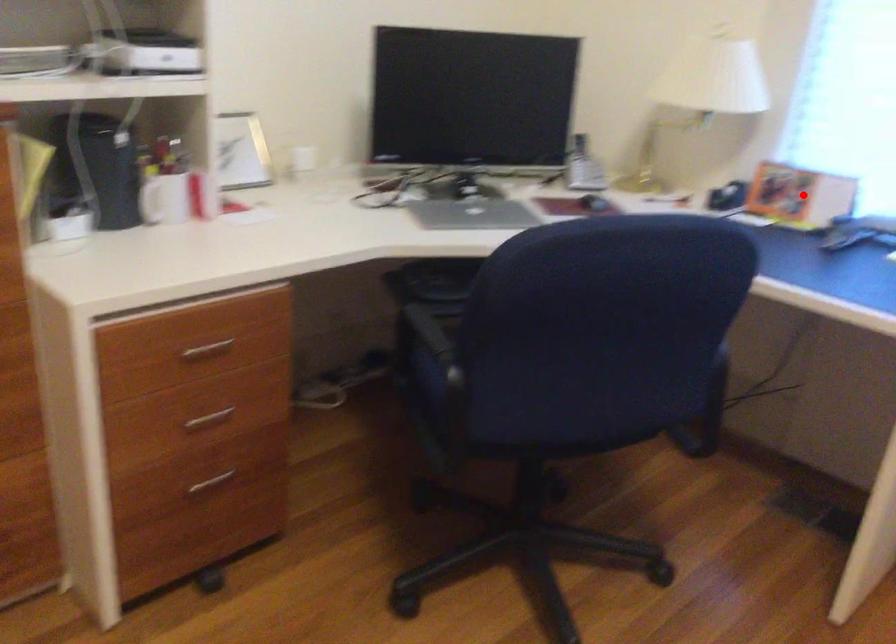
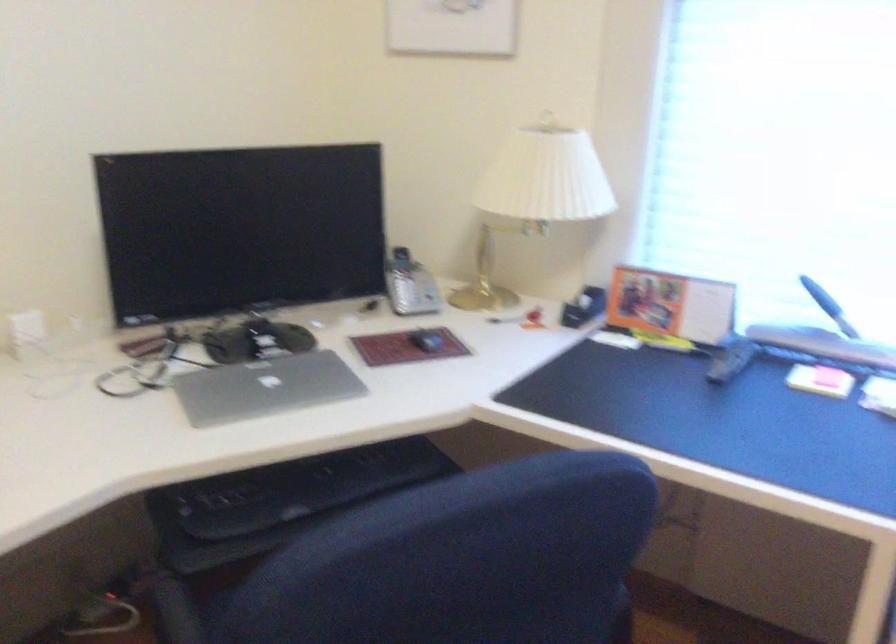
Question: I am providing you with two images of the same scene from different viewpoints. In image1, a red point is highlighted. Considering the same 3D point in image2, which of the following is correct?

Choices:
 (A) It is closer
 (B) It is farther

Answer: (A)